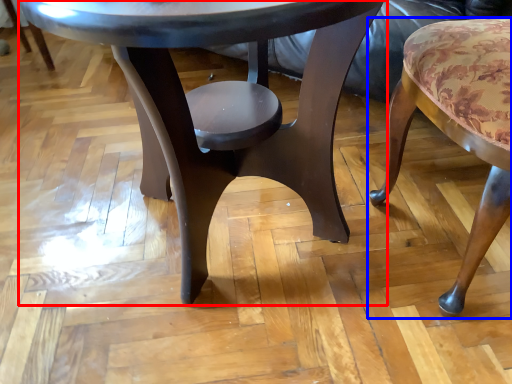
Question: Which of the following is the closest to the observer, coffee table (highlighted by a red box) or chair (highlighted by a blue box)?

Choices:
 (A) coffee table
 (B) chair

Answer: (A)